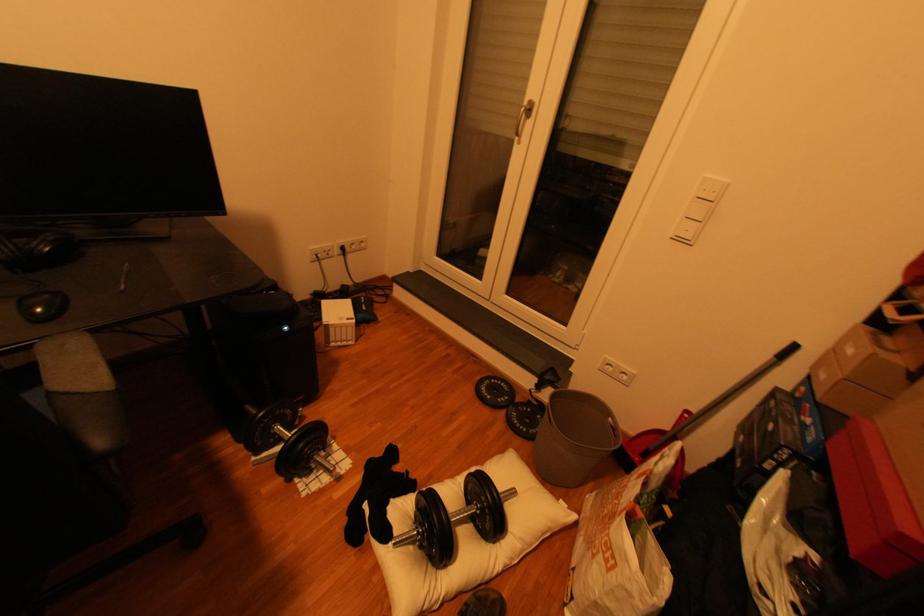
Find where to lift the black weight plate. Please return your answer as a coordinate pair (x, y).

(494, 392)